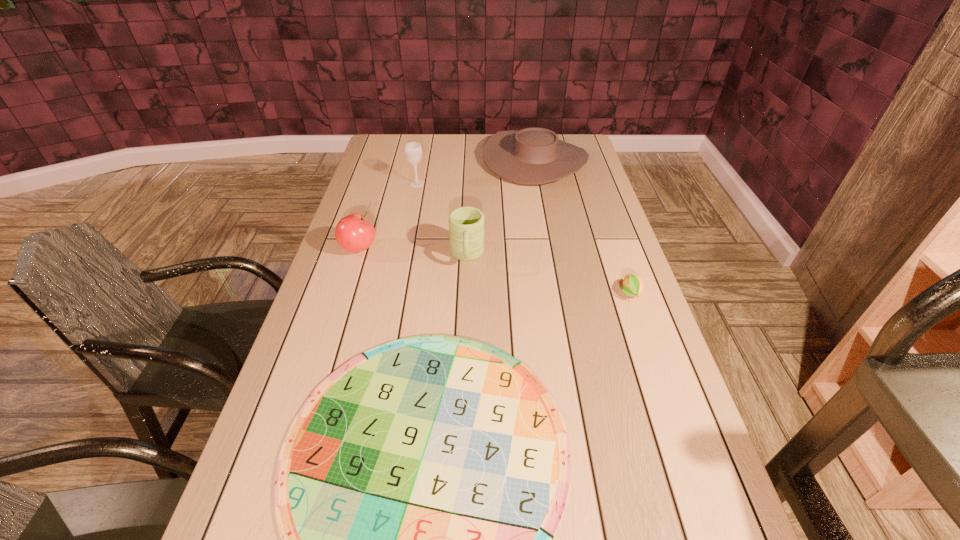
This screenshot has width=960, height=540. I want to click on free location located with leaves positioned above the fifth tallest object, so click(x=680, y=437).

In order to click on object situated at the far edge in this screenshot , I will do `click(534, 155)`.

What are the coordinates of `object that is at the left edge` in the screenshot? It's located at (354, 233).

The width and height of the screenshot is (960, 540). Find the location of `cowboy hat located in the right edge section of the desktop`. cowboy hat located in the right edge section of the desktop is located at coordinates (534, 155).

Find the location of a particular element. The width and height of the screenshot is (960, 540). lemon at the right edge is located at coordinates (633, 285).

Where is `object present at the far right corner`? The image size is (960, 540). object present at the far right corner is located at coordinates (534, 155).

I want to click on vacant space at the far edge of the desktop, so click(x=453, y=154).

Identify the location of vacant space at the left edge. The image size is (960, 540). (324, 379).

Where is `vacant area at the far left corner`? Image resolution: width=960 pixels, height=540 pixels. vacant area at the far left corner is located at coordinates (372, 148).

Image resolution: width=960 pixels, height=540 pixels. Identify the location of free space between the mug and the second nearest object. (548, 274).